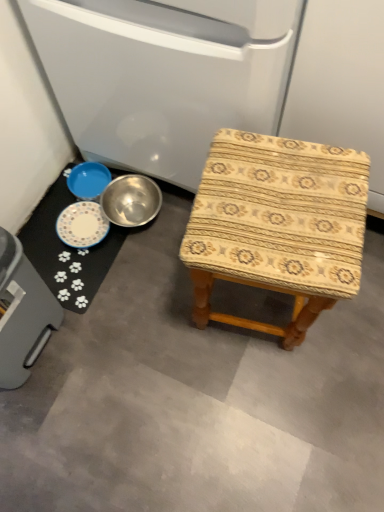
At what (x,y) coordinates should I click in order to perform the action: click on vacant space underneath white paw print mat at lower left (from a real-world perspective). Please return your answer as a coordinate pair (x, y). Looking at the image, I should click on (60, 250).